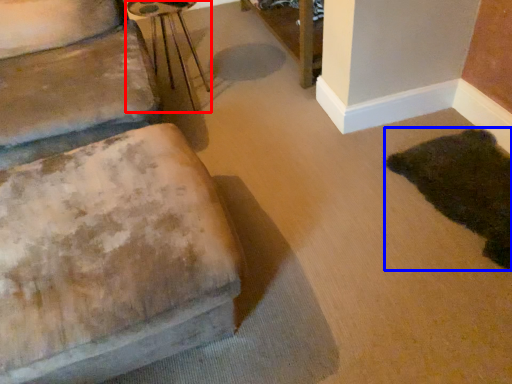
Question: Which point is further to the camera, side table (highlighted by a red box) or animal (highlighted by a blue box)?

Choices:
 (A) side table
 (B) animal

Answer: (A)